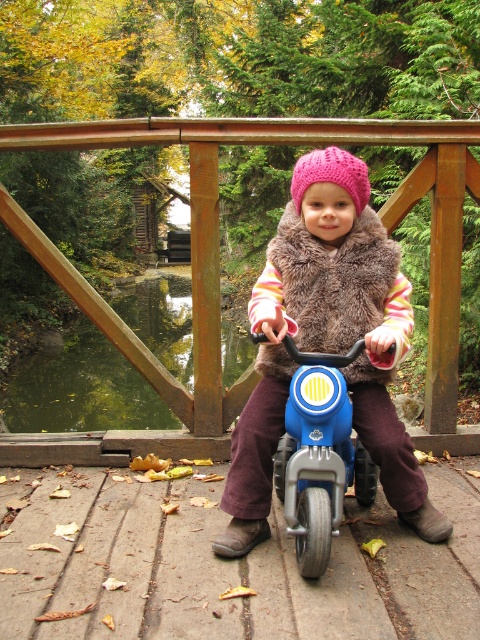
Can you confirm if blue plastic motorcycle at center is taller than pink knitted hat at center?

Yes, blue plastic motorcycle at center is taller than pink knitted hat at center.

Is point (319, 426) less distant than point (357, 177)?

Yes, point (319, 426) is in front of point (357, 177).

Between point (294, 468) and point (367, 170), which one is positioned in front?

Point (294, 468)

The width and height of the screenshot is (480, 640). I want to click on blue plastic motorcycle at center, so click(319, 456).

Does wooden rail at center appear on the left side of matte pink knit hat at center?

Yes, wooden rail at center is to the left of matte pink knit hat at center.

Is the position of wooden rail at center less distant than that of matte pink knit hat at center?

No, wooden rail at center is behind matte pink knit hat at center.

Is point (214, 432) closer to camera compared to point (372, 294)?

No, (214, 432) is further to viewer.

Image resolution: width=480 pixels, height=640 pixels. I want to click on wooden rail at center, so click(x=218, y=273).

Where is `wooden rail at center`? wooden rail at center is located at coordinates click(x=218, y=273).

Is wooden rail at center bigger than pink knitted hat at center?

Correct, wooden rail at center is larger in size than pink knitted hat at center.

The image size is (480, 640). I want to click on wooden rail at center, so click(218, 273).